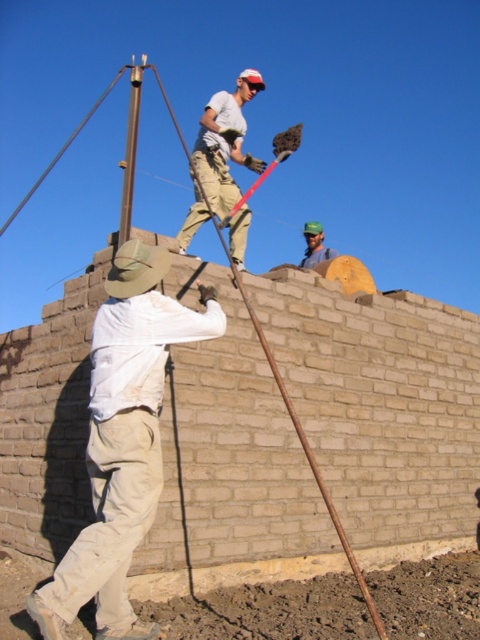
Is matte khaki pants at upper center wider than green fabric cap at upper center?

Yes, matte khaki pants at upper center is wider than green fabric cap at upper center.

Who is shorter, matte khaki pants at upper center or green fabric cap at upper center?

Standing shorter between the two is green fabric cap at upper center.

Between point (233, 161) and point (307, 257), which one is positioned behind?

The point (307, 257) is behind.

Where is `matte khaki pants at upper center`? This screenshot has height=640, width=480. matte khaki pants at upper center is located at coordinates coord(225,141).

Can you confirm if white cotton shirt at center is shorter than green fabric cap at upper center?

Indeed, white cotton shirt at center has a lesser height compared to green fabric cap at upper center.

Between white cotton shirt at center and green fabric cap at upper center, which one is positioned lower?

white cotton shirt at center is lower down.

Who is more distant from viewer, [208,308] or [315,230]?

Point [315,230]

Locate an element on the screen. white cotton shirt at center is located at coordinates [122, 440].

Is point (99, 470) closer to camera compared to point (244, 99)?

Yes, point (99, 470) is closer to viewer.

You are a GUI agent. You are given a task and a screenshot of the screen. Output one action in this format:
    pyautogui.click(x=<x>, y=<y>)
    Task: Click on the white cotton shirt at center
    Image resolution: width=480 pixels, height=640 pixels.
    Given the screenshot: What is the action you would take?
    pyautogui.click(x=122, y=440)